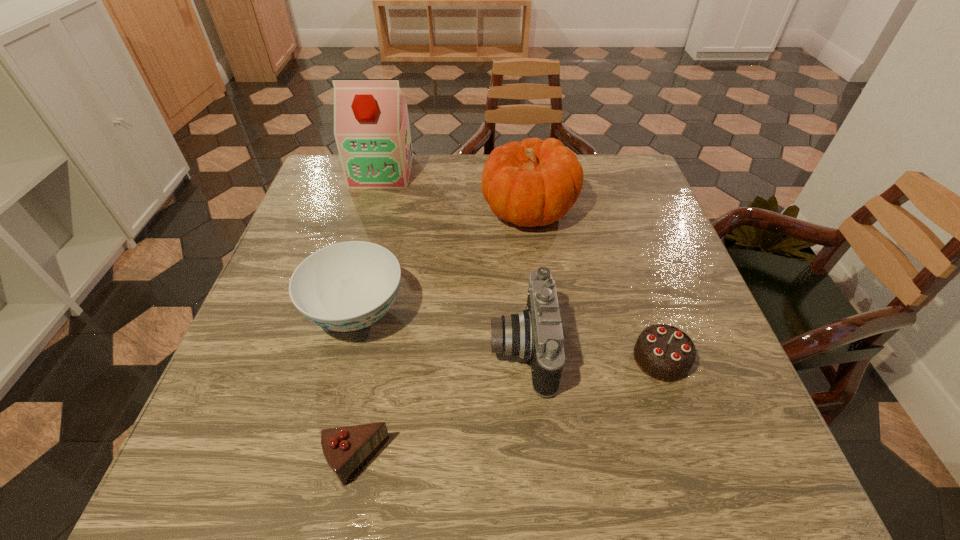
Find the location of a particular element. The width and height of the screenshot is (960, 540). chinaware present at the left edge is located at coordinates (347, 286).

Identify the location of object located in the right edge section of the desktop. click(x=663, y=352).

Identify the location of object at the far left corner. This screenshot has height=540, width=960. (371, 126).

In the image, there is a desktop. At what (x,y) coordinates should I click in order to perform the action: click on vacant space at the far edge. Please return your answer as a coordinate pair (x, y). Image resolution: width=960 pixels, height=540 pixels. Looking at the image, I should click on (446, 198).

The image size is (960, 540). I want to click on vacant space at the near edge of the desktop, so click(528, 440).

Find the location of `vacant space at the left edge of the desktop`. vacant space at the left edge of the desktop is located at coordinates (x=321, y=212).

I want to click on vacant point at the right edge, so click(639, 314).

Find the location of `free spot at the near left corner of the desktop`. free spot at the near left corner of the desktop is located at coordinates (245, 484).

You are a GUI agent. You are given a task and a screenshot of the screen. Output one action in this format:
    pyautogui.click(x=<x>, y=<y>)
    Task: Click on the free space between the pumpkin and the chinaware
    The image size is (960, 540).
    Given the screenshot: What is the action you would take?
    pyautogui.click(x=443, y=261)

Where is `vacant area that lies between the camera and the pumpkin`? Image resolution: width=960 pixels, height=540 pixels. vacant area that lies between the camera and the pumpkin is located at coordinates (x=525, y=279).